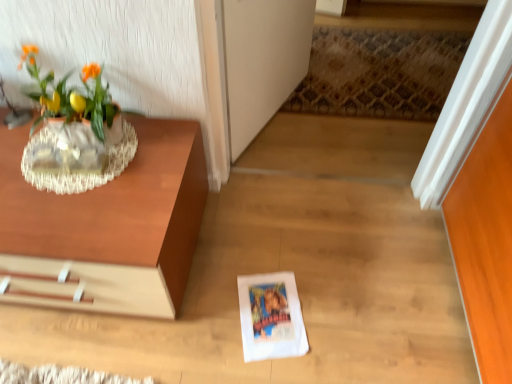
Where is `free point to the right of transparent glass door at center`? The image size is (512, 384). free point to the right of transparent glass door at center is located at coordinates (355, 116).